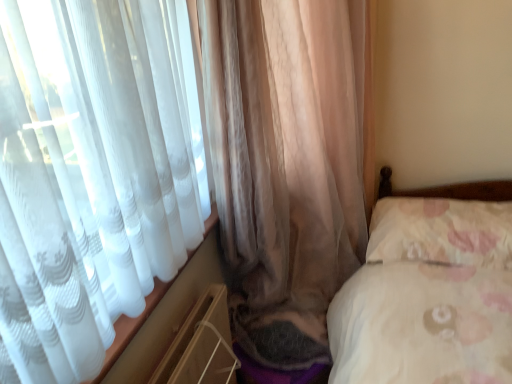
Question: Is fluffy white pillow at right not within translucent beige curtain at left, positioned as the 2th curtain in right-to-left order?

Choices:
 (A) yes
 (B) no

Answer: (B)

Question: From the image's perspective, does fluffy white pillow at right appear lower than translucent beige curtain at left, positioned as the 2th curtain in right-to-left order?

Choices:
 (A) no
 (B) yes

Answer: (B)

Question: From a real-world perspective, is fluffy white pillow at right below translucent beige curtain at left, the 1th curtain in the left-to-right sequence?

Choices:
 (A) yes
 (B) no

Answer: (A)

Question: From a real-world perspective, is fluffy white pillow at right over translucent beige curtain at left, positioned as the 2th curtain in right-to-left order?

Choices:
 (A) yes
 (B) no

Answer: (B)

Question: Can you confirm if fluffy white pillow at right is thinner than translucent beige curtain at left, positioned as the 2th curtain in right-to-left order?

Choices:
 (A) no
 (B) yes

Answer: (B)

Question: Is fluffy white pillow at right looking in the opposite direction of translucent beige curtain at left, the 1th curtain in the left-to-right sequence?

Choices:
 (A) yes
 (B) no

Answer: (A)

Question: Is translucent beige curtain at left, positioned as the 2th curtain in right-to-left order, positioned with its back to fluffy white pillow at right?

Choices:
 (A) no
 (B) yes

Answer: (A)

Question: Are translucent beige curtain at left, positioned as the 2th curtain in right-to-left order, and fluffy white pillow at right making contact?

Choices:
 (A) no
 (B) yes

Answer: (A)

Question: Does translucent beige curtain at left, the 1th curtain in the left-to-right sequence, have a larger size compared to fluffy white pillow at right?

Choices:
 (A) yes
 (B) no

Answer: (A)

Question: Is translucent beige curtain at left, positioned as the 2th curtain in right-to-left order, shorter than fluffy white pillow at right?

Choices:
 (A) no
 (B) yes

Answer: (A)

Question: Is the depth of translucent beige curtain at left, the 1th curtain in the left-to-right sequence, greater than that of fluffy white pillow at right?

Choices:
 (A) yes
 (B) no

Answer: (B)

Question: Is translucent beige curtain at left, positioned as the 2th curtain in right-to-left order, far from fluffy white pillow at right?

Choices:
 (A) yes
 (B) no

Answer: (B)

Question: Is translucent fabric curtain at left, marked as the 1th curtain in a right-to-left arrangement, facing away from fluffy white pillow at right?

Choices:
 (A) no
 (B) yes

Answer: (B)